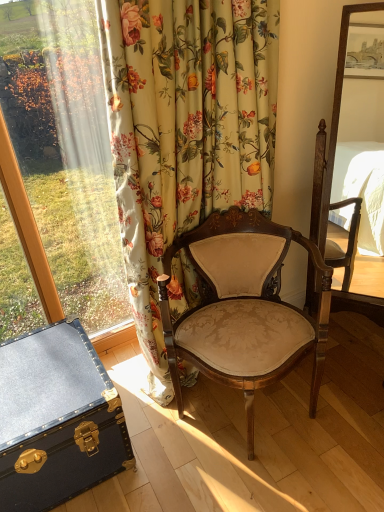
Find the location of `blue leather trunk at lower left`. blue leather trunk at lower left is located at coordinates (57, 419).

I want to click on floral fabric curtain at left, so click(185, 131).

This screenshot has height=512, width=384. What do you see at coordinates (244, 309) in the screenshot? I see `matte beige fabric chair at center` at bounding box center [244, 309].

In order to click on blue leather trunk at lower left in this screenshot , I will do `click(57, 419)`.

Is floral fabric curtain at left facing towards matte beige fabric chair at center?

Yes, floral fabric curtain at left is turned towards matte beige fabric chair at center.

Between point (220, 151) and point (249, 431), which one is positioned behind?

The point (249, 431) is farther from the camera.

Considering the relative sizes of floral fabric curtain at left and matte beige fabric chair at center in the image provided, is floral fabric curtain at left taller than matte beige fabric chair at center?

Yes.

Can you tell me how much matte beige fabric chair at center and blue leather trunk at lower left differ in facing direction?

matte beige fabric chair at center and blue leather trunk at lower left are facing 24 degrees away from each other.

Considering the sizes of objects matte beige fabric chair at center and blue leather trunk at lower left in the image provided, who is smaller, matte beige fabric chair at center or blue leather trunk at lower left?

blue leather trunk at lower left.

From the picture: Does matte beige fabric chair at center appear on the left side of blue leather trunk at lower left?

No.

Do you think matte beige fabric chair at center is within blue leather trunk at lower left, or outside of it?

The correct answer is: outside.

From the image's perspective, between floral fabric curtain at left and blue leather trunk at lower left, who is located below?

blue leather trunk at lower left is shown below in the image.

Locate an element on the screen. This screenshot has width=384, height=512. the chest lying behind the floral fabric curtain at left is located at coordinates 57,419.

Considering the points (122, 129) and (39, 386), which point is in front, point (122, 129) or point (39, 386)?

The point (122, 129) is closer.

Measure the distance from floral fabric curtain at left to blue leather trunk at lower left.

floral fabric curtain at left is 55.06 centimeters from blue leather trunk at lower left.

Can you confirm if matte beige fabric chair at center is smaller than floral fabric curtain at left?

Actually, matte beige fabric chair at center might be larger than floral fabric curtain at left.

Identify the location of curtain located above the matte beige fabric chair at center (from a real-world perspective). The image size is (384, 512). [x=185, y=131].

From a real-world perspective, which is physically below, matte beige fabric chair at center or floral fabric curtain at left?

matte beige fabric chair at center is physically lower.

Based on the photo, is matte beige fabric chair at center positioned with its back to floral fabric curtain at left?

Yes, floral fabric curtain at left is at the back of matte beige fabric chair at center.

This screenshot has width=384, height=512. Identify the location of the chest behind the matte beige fabric chair at center. (57, 419).

Consider the image. Is blue leather trunk at lower left far away from matte beige fabric chair at center?

That's not correct — blue leather trunk at lower left is a little close to matte beige fabric chair at center.

In the scene shown: From a real-world perspective, is blue leather trunk at lower left over matte beige fabric chair at center?

Incorrect, from a real-world perspective, blue leather trunk at lower left is lower than matte beige fabric chair at center.

Which of these two, blue leather trunk at lower left or floral fabric curtain at left, is thinner?

floral fabric curtain at left is thinner.

Considering the positions of objects blue leather trunk at lower left and floral fabric curtain at left in the image provided, who is more to the left, blue leather trunk at lower left or floral fabric curtain at left?

Positioned to the left is blue leather trunk at lower left.

From a real-world perspective, is blue leather trunk at lower left positioned above or below floral fabric curtain at left?

blue leather trunk at lower left is below floral fabric curtain at left.

Locate an element on the screen. The width and height of the screenshot is (384, 512). chair behind the floral fabric curtain at left is located at coordinates (244, 309).

I want to click on chair that is above the blue leather trunk at lower left (from the image's perspective), so click(x=244, y=309).

Looking at the image, which one is located further to blue leather trunk at lower left, matte beige fabric chair at center or floral fabric curtain at left?

floral fabric curtain at left is positioned further to the anchor blue leather trunk at lower left.

When comparing their distances from floral fabric curtain at left, does blue leather trunk at lower left or matte beige fabric chair at center seem closer?

matte beige fabric chair at center.

Based on their spatial positions, is blue leather trunk at lower left or floral fabric curtain at left closer to matte beige fabric chair at center?

floral fabric curtain at left.

Estimate the real-world distances between objects in this image. Which object is further from blue leather trunk at lower left, floral fabric curtain at left or matte beige fabric chair at center?

floral fabric curtain at left is positioned further to the anchor blue leather trunk at lower left.

Estimate the real-world distances between objects in this image. Which object is closer to floral fabric curtain at left, matte beige fabric chair at center or blue leather trunk at lower left?

matte beige fabric chair at center is closer to floral fabric curtain at left.

Estimate the real-world distances between objects in this image. Which object is closer to matte beige fabric chair at center, floral fabric curtain at left or blue leather trunk at lower left?

floral fabric curtain at left is positioned closer to the anchor matte beige fabric chair at center.

Where is `curtain located between blue leather trunk at lower left and matte beige fabric chair at center in the left-right direction`? curtain located between blue leather trunk at lower left and matte beige fabric chair at center in the left-right direction is located at coordinates (185, 131).